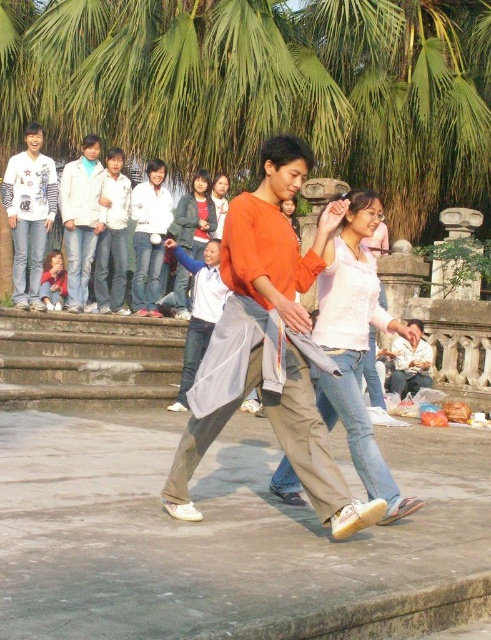
Question: Can you confirm if white cotton jacket at upper left is thinner than white matte jacket at center?

Choices:
 (A) no
 (B) yes

Answer: (A)

Question: Which object is closer to the camera taking this photo?

Choices:
 (A) matte gray hoodie at center
 (B) matte pink shirt at lower left

Answer: (B)

Question: Does orange cotton shirt at center have a greater width compared to matte gray hoodie at center?

Choices:
 (A) no
 (B) yes

Answer: (B)

Question: Estimate the real-world distances between objects in this image. Which object is farther from the light pink fabric shirt at center?

Choices:
 (A) white printed shirt at upper left
 (B) white matte jacket at center
 (C) white cotton shirt at lower right
 (D) matte gray hoodie at center

Answer: (B)

Question: Does light pink fabric shirt at center have a greater width compared to white glossy shirt at center?

Choices:
 (A) no
 (B) yes

Answer: (A)

Question: Among these points, which one is nearest to the camera?

Choices:
 (A) (226, 376)
 (B) (372, 476)
 (C) (51, 280)
 (D) (76, 177)

Answer: (A)